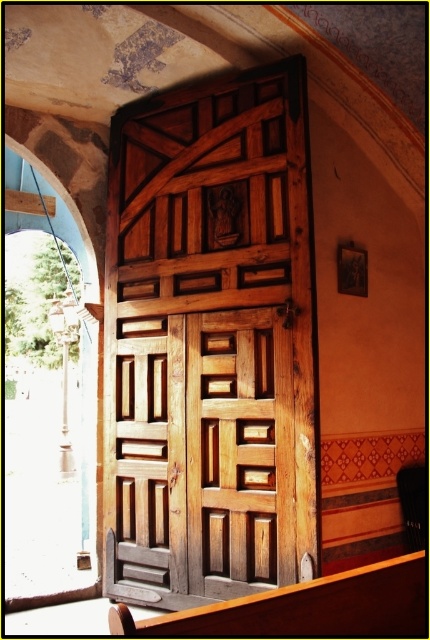
Can you confirm if natural wood door at center is shorter than wooden polished bench at lower center?

In fact, natural wood door at center may be taller than wooden polished bench at lower center.

Does natural wood door at center have a larger size compared to wooden polished bench at lower center?

Yes.

I want to click on natural wood door at center, so click(x=209, y=342).

This screenshot has height=640, width=430. I want to click on natural wood door at center, so click(x=209, y=342).